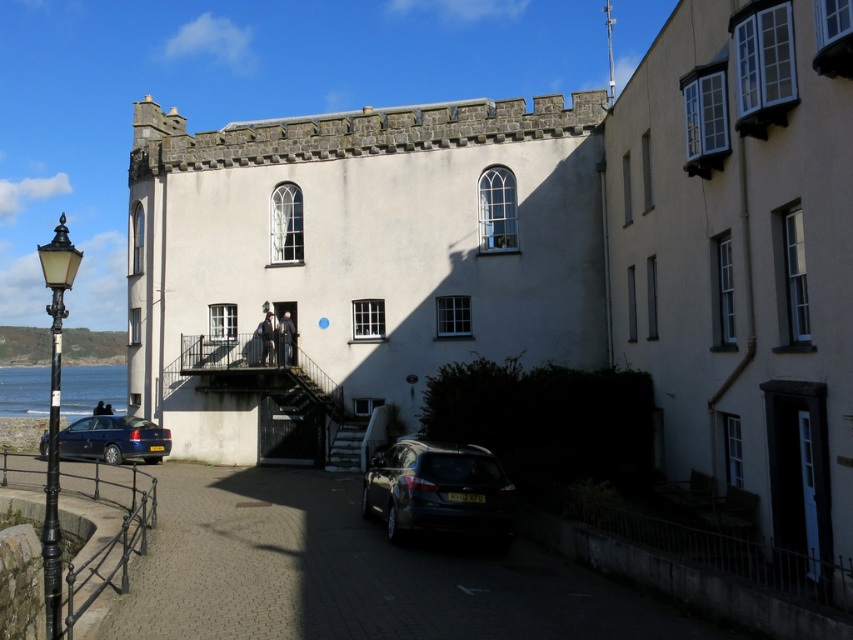
Question: Which point is closer to the camera?

Choices:
 (A) metallic gray staircase at center
 (B) wooden staircase at center

Answer: (B)

Question: Which of the following is the closest to the observer?

Choices:
 (A) wooden staircase at center
 (B) shiny black car at lower center
 (C) metallic gray staircase at center
 (D) metallic blue hatchback at lower left

Answer: (D)

Question: Is shiny black car at lower center bigger than wooden staircase at center?

Choices:
 (A) no
 (B) yes

Answer: (B)

Question: Which object appears closest to the camera in this image?

Choices:
 (A) metallic blue hatchback at lower left
 (B) blue water at lower left
 (C) shiny black car at lower center

Answer: (A)

Question: Is the position of shiny black car at lower center less distant than that of metallic blue hatchback at lower left?

Choices:
 (A) yes
 (B) no

Answer: (B)

Question: Is shiny black car at lower center thinner than metallic gray staircase at center?

Choices:
 (A) no
 (B) yes

Answer: (B)